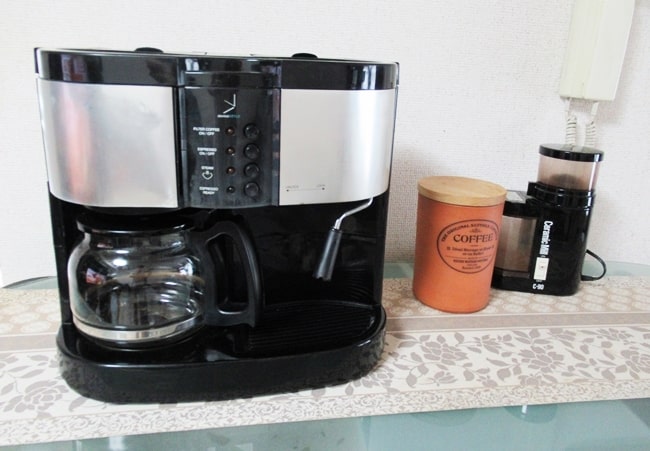
Find the location of a particular element. power cord is located at coordinates tap(603, 269).